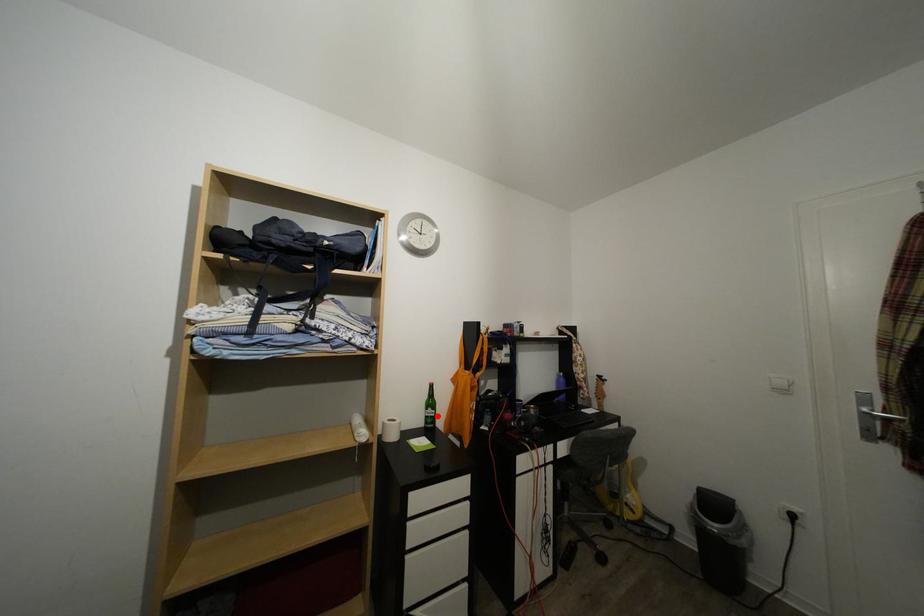
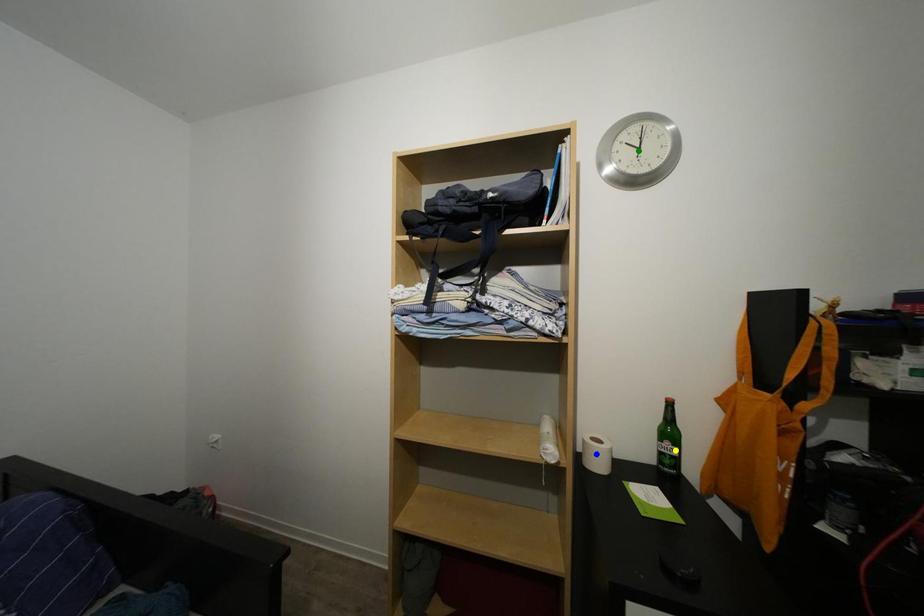
Question: I am providing you with two images of the same scene from different viewpoints. A red point is marked on the first image. You are given multiple points on the second image. Can you choose the point in image 2 that corresponds to the point in image 1?

Choices:
 (A) yellow point
 (B) blue point
 (C) green point

Answer: (A)